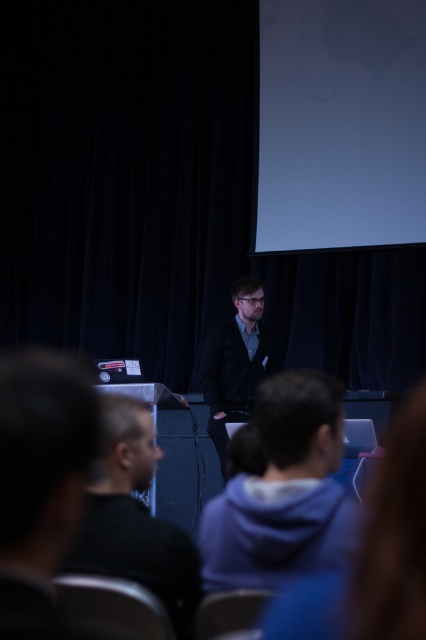
Can you confirm if dark gray hoodie at center is taller than dark gray hoodie at lower center?

No.

Who is more distant from viewer, (357, 509) or (192, 561)?

The point (192, 561) is behind.

At what (x,y) coordinates should I click in order to perform the action: click on dark gray hoodie at center. Please return your answer as a coordinate pair (x, y). Looking at the image, I should click on (284, 492).

The width and height of the screenshot is (426, 640). Identify the location of dark gray hoodie at center. (284, 492).

Looking at this image, which of these two, dark gray hoodie at lower center or dark blue jacket at center, stands taller?

dark blue jacket at center

Is dark gray hoodie at lower center positioned behind dark blue jacket at center?

No, dark gray hoodie at lower center is closer to the viewer.

Is point (127, 420) positioned in front of point (213, 381)?

Yes, point (127, 420) is in front of point (213, 381).

At what (x,y) coordinates should I click in order to perform the action: click on dark gray hoodie at lower center. Please return your answer as a coordinate pair (x, y). Looking at the image, I should click on (135, 516).

Is dark gray hoodie at center to the left of dark blue jacket at center from the viewer's perspective?

Indeed, dark gray hoodie at center is positioned on the left side of dark blue jacket at center.

Between dark gray hoodie at center and dark blue jacket at center, which one is positioned lower?

dark blue jacket at center is below.

You are a GUI agent. You are given a task and a screenshot of the screen. Output one action in this format:
    pyautogui.click(x=<x>, y=<y>)
    Task: Click on the dark gray hoodie at center
    Image resolution: width=426 pixels, height=640 pixels.
    Given the screenshot: What is the action you would take?
    pyautogui.click(x=284, y=492)

Identify the location of dark gray hoodie at center. The height and width of the screenshot is (640, 426). (284, 492).